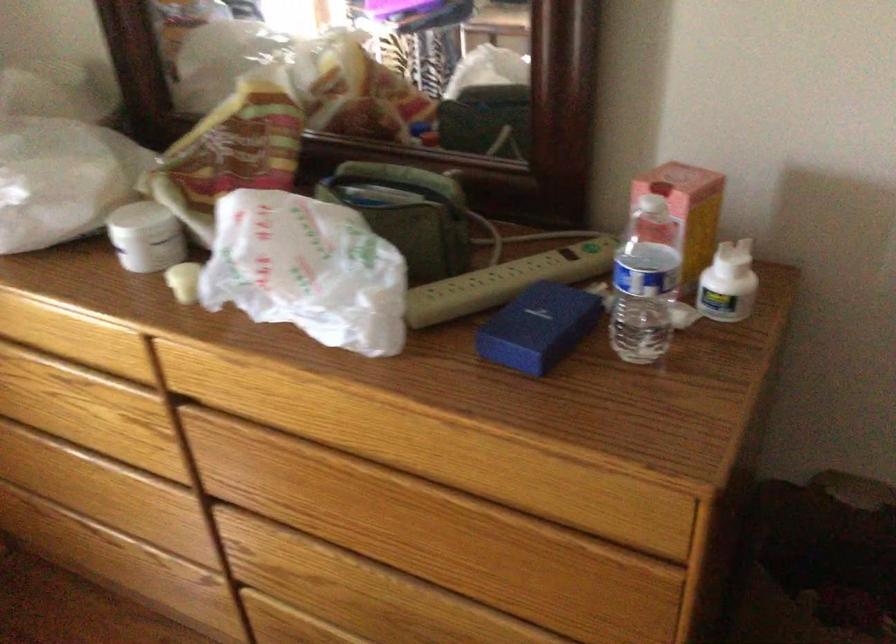
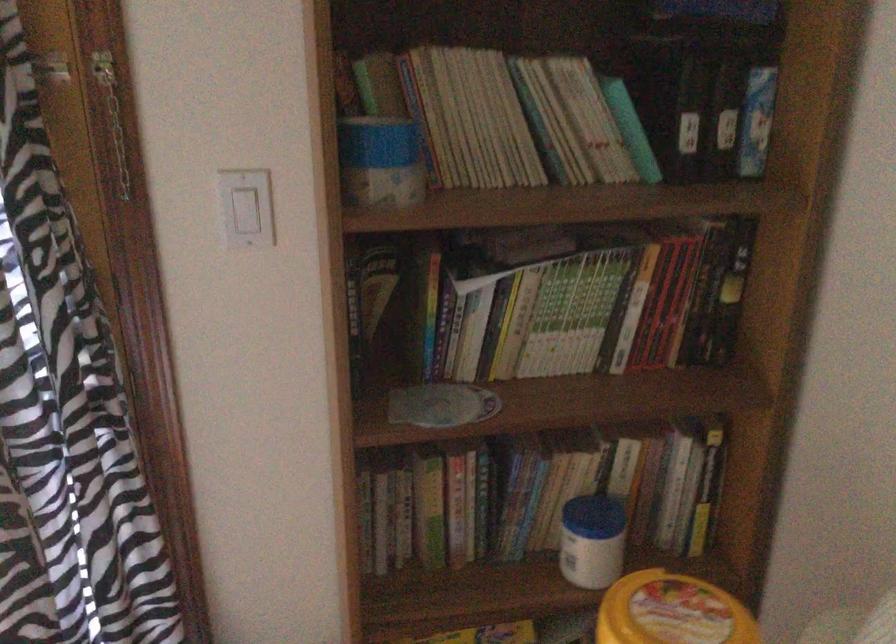
Question: The camera is either moving clockwise (left) or counter-clockwise (right) around the object. The first image is from the beginning of the video and the second image is from the end. Is the camera moving left or right when shooting the video?

Choices:
 (A) Left
 (B) Right

Answer: (B)